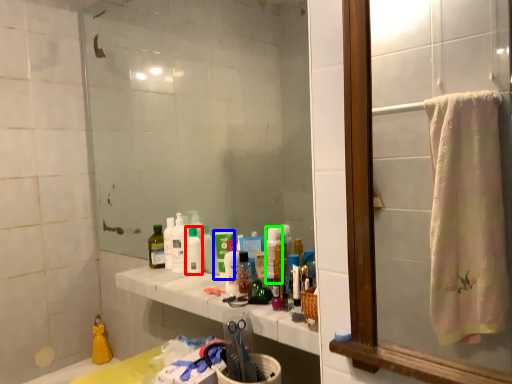
Question: Which object is positioned farthest from mouthwash (highlighted by a red box)? Select from mouthwash (highlighted by a blue box) and cleaning product (highlighted by a green box).

Choices:
 (A) mouthwash
 (B) cleaning product

Answer: (B)